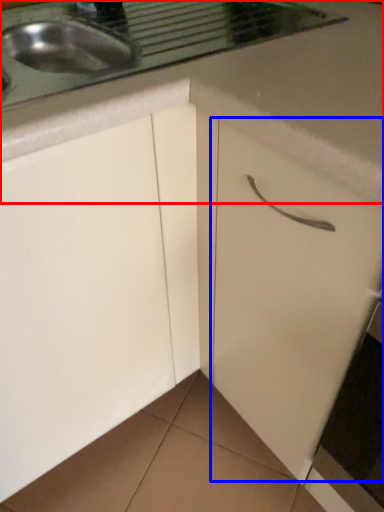
Question: Which point is further to the camera, countertop (highlighted by a red box) or drawer (highlighted by a blue box)?

Choices:
 (A) countertop
 (B) drawer

Answer: (A)